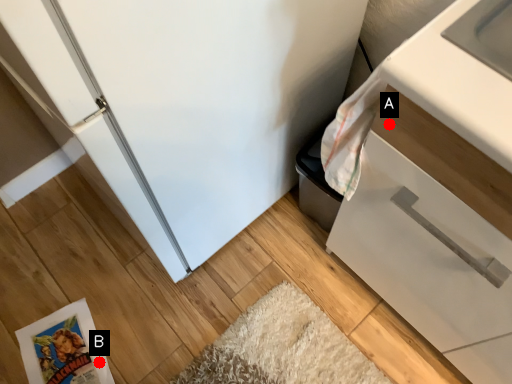
Question: Two points are circled on the image, labeled by A and B beside each circle. Which point appears closest to the camera in this image?

Choices:
 (A) A is closer
 (B) B is closer

Answer: (A)